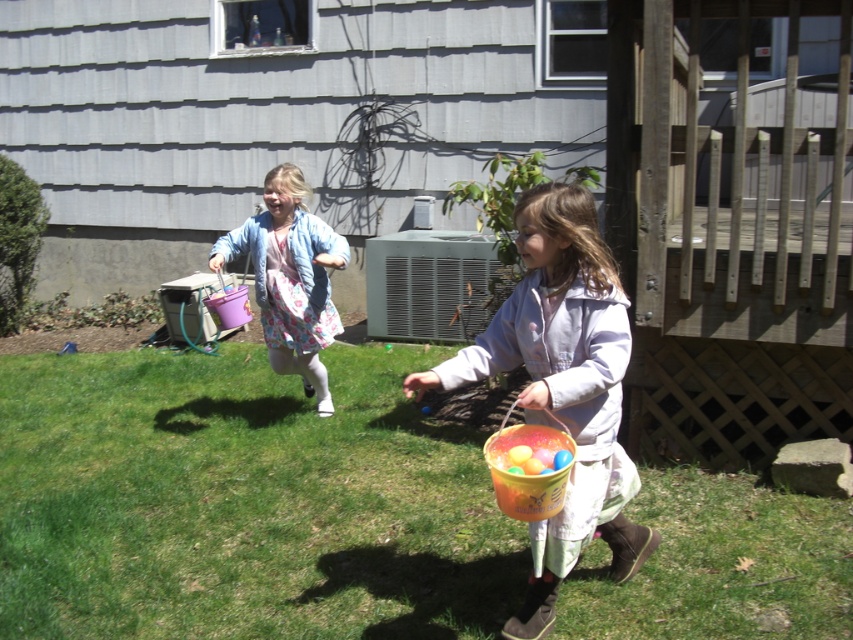
Question: Which point is farther to the camera?

Choices:
 (A) (312, 326)
 (B) (137, 365)
 (C) (581, 353)

Answer: (B)

Question: Which of the following is the closest to the observer?

Choices:
 (A) (560, 257)
 (B) (277, 305)

Answer: (A)

Question: Is matte orange bucket at center above matte pink bucket at center?

Choices:
 (A) no
 (B) yes

Answer: (A)

Question: Estimate the real-world distances between objects in this image. Which object is farther from the green grass at lower center?

Choices:
 (A) matte pink bucket at center
 (B) matte orange bucket at center

Answer: (B)

Question: Is green grass at lower center above matte orange bucket at center?

Choices:
 (A) no
 (B) yes

Answer: (A)

Question: Is matte orange bucket at center above matte pink bucket at center?

Choices:
 (A) yes
 (B) no

Answer: (B)